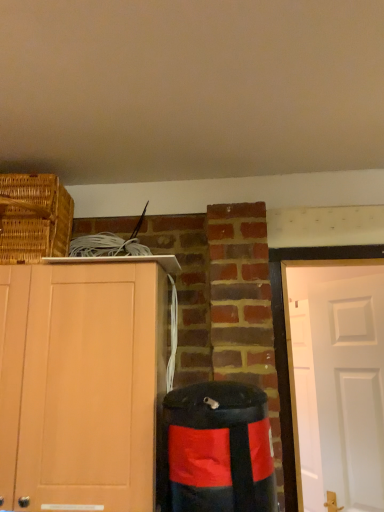
Question: Looking at their shapes, would you say light wood cabinet at left is wider or thinner than woven brown basket at upper left?

Choices:
 (A) wide
 (B) thin

Answer: (B)

Question: Based on their sizes in the image, would you say light wood cabinet at left is bigger or smaller than woven brown basket at upper left?

Choices:
 (A) small
 (B) big

Answer: (B)

Question: Based on their relative distances, which object is farther from the woven brown basket at upper left?

Choices:
 (A) light wood cabinet at left
 (B) black matte waste container at lower right

Answer: (B)

Question: Which object is the closest to the black matte waste container at lower right?

Choices:
 (A) woven brown basket at upper left
 (B) light wood cabinet at left

Answer: (B)